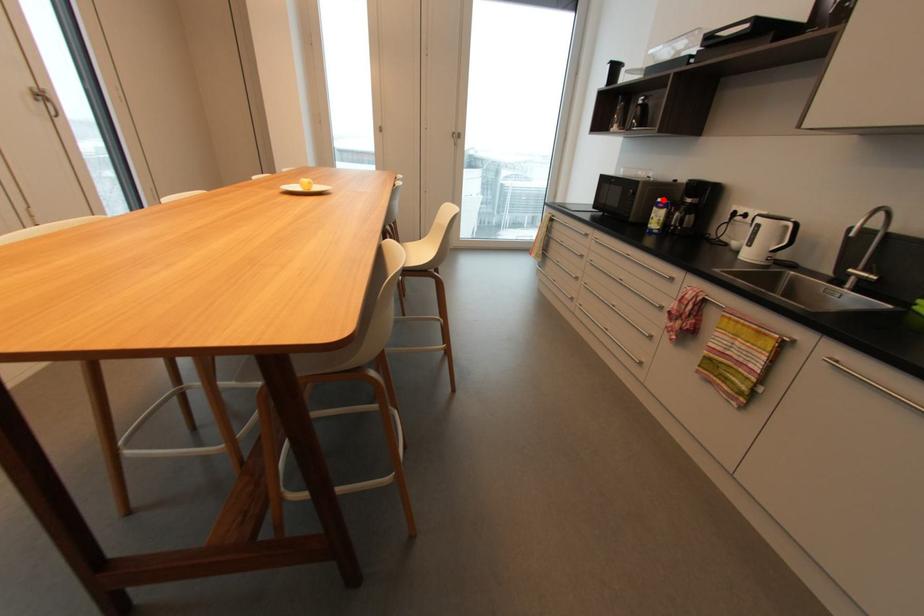
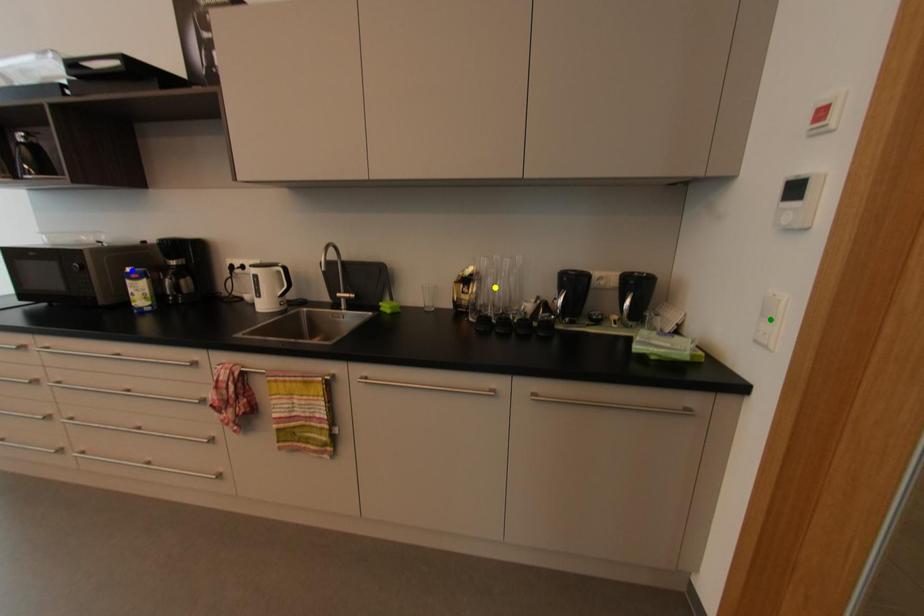
Question: I am providing you with two images of the same scene from different viewpoints. A red point is marked on the first image. You are given multiple points on the second image. Which spot in image 2 lines up with the point in image 1?

Choices:
 (A) yellow point
 (B) blue point
 (C) green point

Answer: (B)